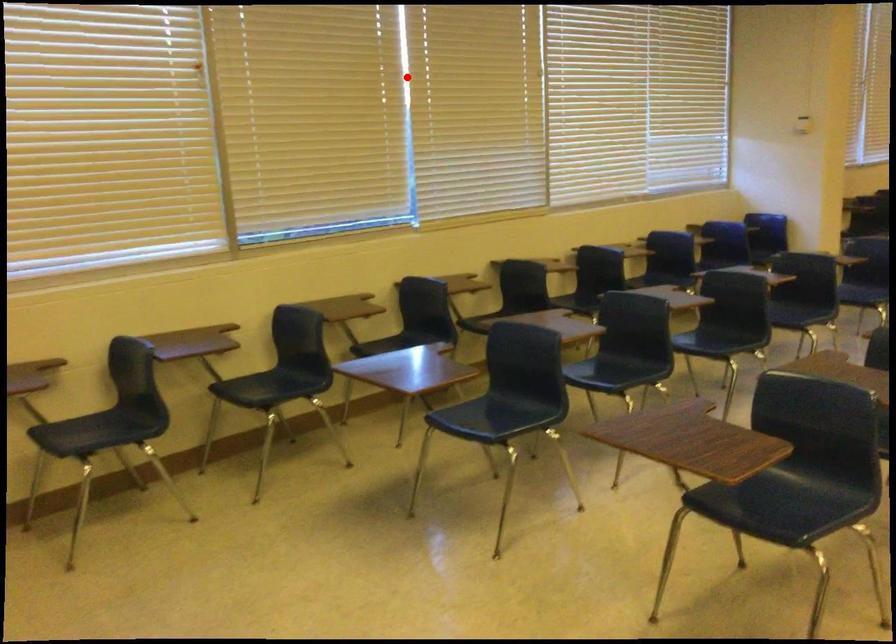
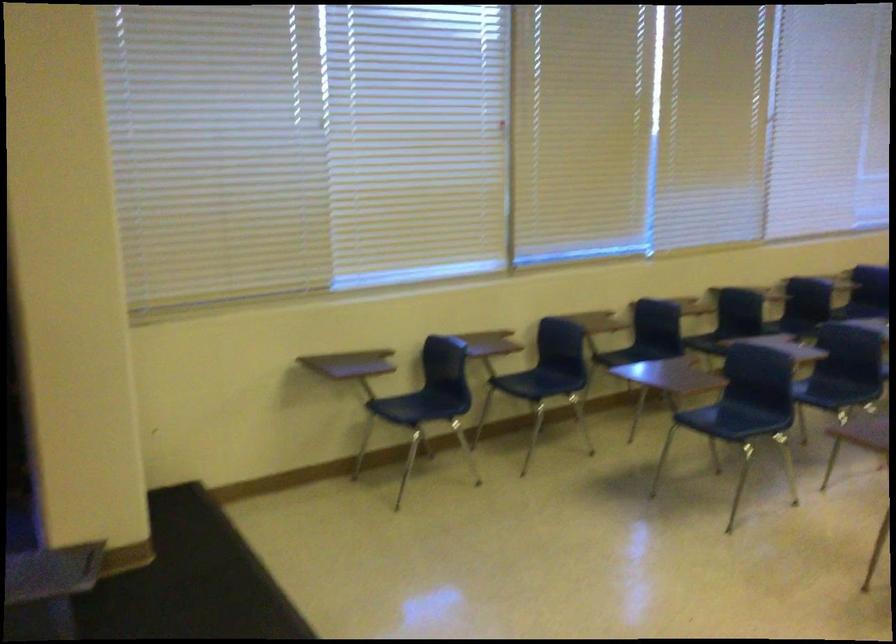
Locate, in the second image, the point that corresponds to the highlighted location in the first image.

(653, 134)